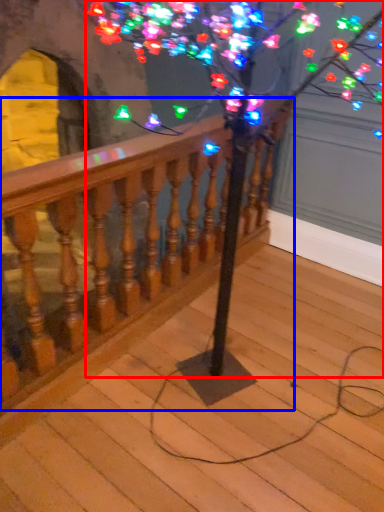
Question: Which of the following is the closest to the observer, tree (highlighted by a red box) or rail (highlighted by a blue box)?

Choices:
 (A) tree
 (B) rail

Answer: (A)